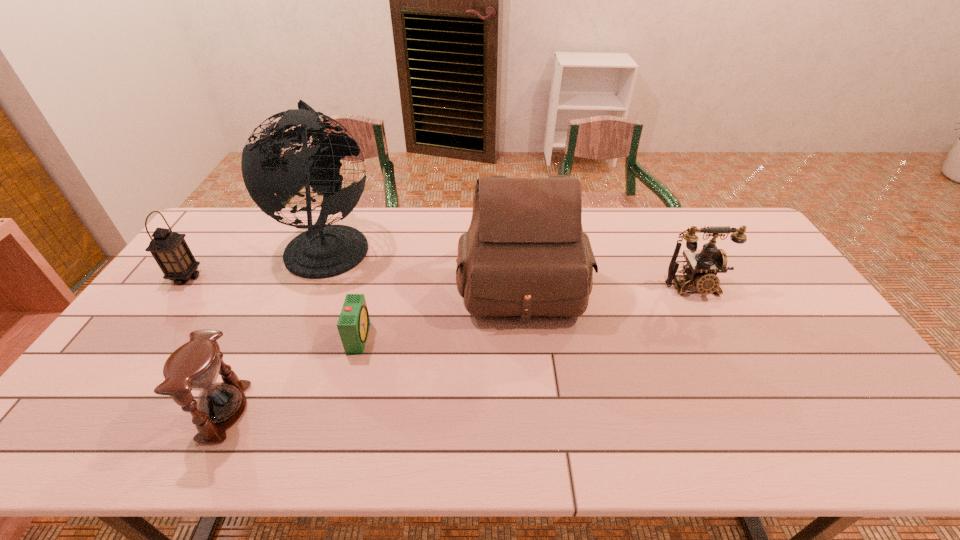
At what (x,y) coordinates should I click in order to perform the action: click on vacant point located on the rotary dial of the telephone. Please return your answer as a coordinate pair (x, y). This screenshot has height=540, width=960. Looking at the image, I should click on (747, 390).

The width and height of the screenshot is (960, 540). I want to click on free space located on the left of the nearest object, so click(x=125, y=411).

At what (x,y) coordinates should I click in order to perform the action: click on free space located on the front-facing side of the alarm clock. Please return your answer as a coordinate pair (x, y). Looking at the image, I should click on (426, 337).

Where is `object located in the far edge section of the desktop`? Image resolution: width=960 pixels, height=540 pixels. object located in the far edge section of the desktop is located at coordinates (323, 251).

Locate an element on the screen. Image resolution: width=960 pixels, height=540 pixels. object that is at the near edge is located at coordinates (194, 366).

The width and height of the screenshot is (960, 540). I want to click on object present at the left edge, so click(x=169, y=249).

The height and width of the screenshot is (540, 960). I want to click on blank area at the far edge, so click(658, 244).

Identify the location of vacant region at the near edge. (798, 435).

Identify the location of free space at the left edge of the desktop. (211, 293).

This screenshot has width=960, height=540. In order to click on free space at the far left corner of the desktop in this screenshot , I will do `click(236, 210)`.